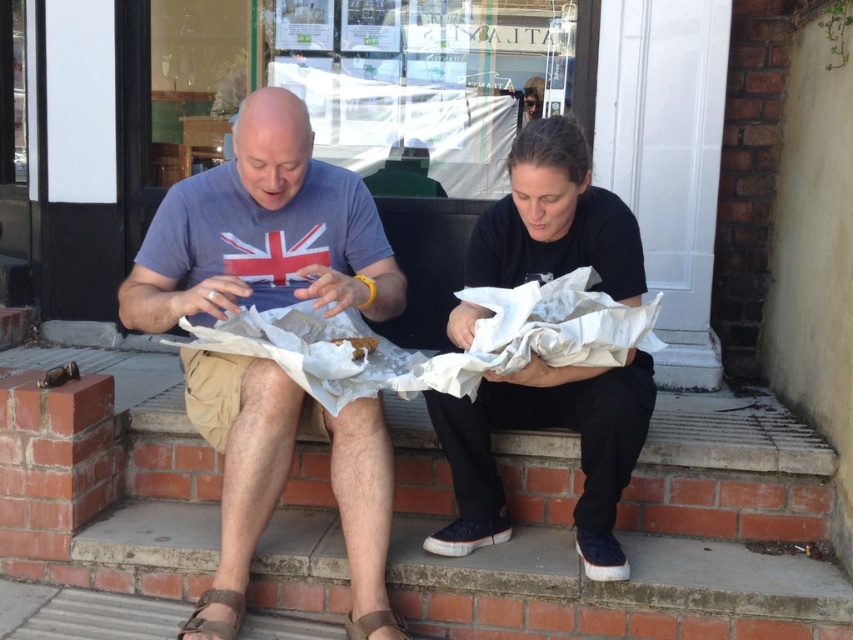
Does black matte paper bag at center have a smaller size compared to brown leather sandal at lower center?

No, black matte paper bag at center is not smaller than brown leather sandal at lower center.

Is black matte paper bag at center positioned behind brown leather sandal at lower center?

No, it is not.

What do you see at coordinates (541, 428) in the screenshot? I see `black matte paper bag at center` at bounding box center [541, 428].

The width and height of the screenshot is (853, 640). I want to click on black matte paper bag at center, so click(541, 428).

Does point (224, 202) come closer to viewer compared to point (572, 410)?

That is False.

Does point (325, 204) lie behind point (622, 280)?

Yes, point (325, 204) is farther from viewer.

The image size is (853, 640). Identify the location of matte blue t-shirt at center. (263, 232).

Who is positioned more to the left, brown leather sandal at lower left or brown leather sandal at lower center?

Positioned to the left is brown leather sandal at lower left.

Identify the location of brown leather sandal at lower left. This screenshot has height=640, width=853. (216, 620).

At what (x,y) coordinates should I click in order to perform the action: click on brown leather sandal at lower left. Please return your answer as a coordinate pair (x, y). Image resolution: width=853 pixels, height=640 pixels. Looking at the image, I should click on (216, 620).